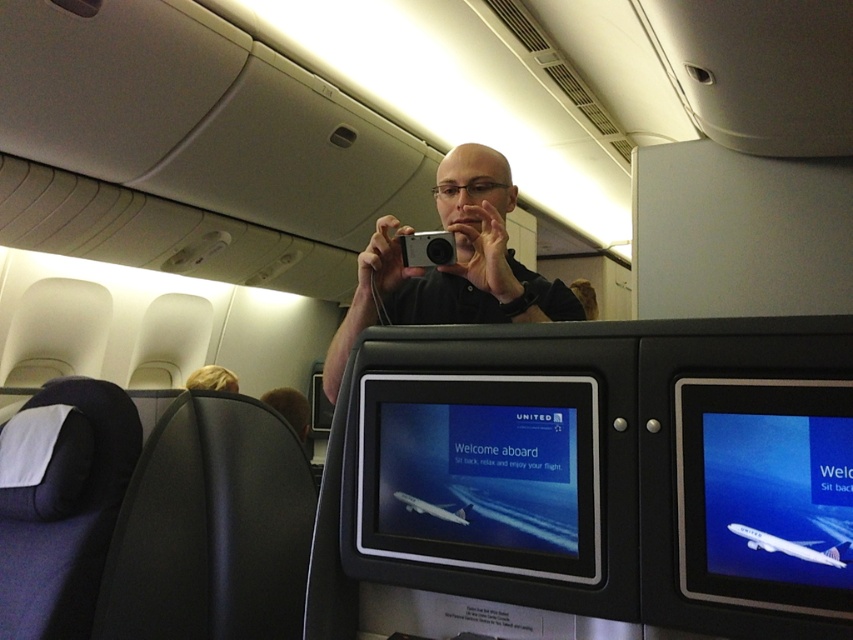
Can you confirm if blue glossy airplane at center is thinner than white glossy airplane at upper center?

Incorrect, blue glossy airplane at center's width is not less than white glossy airplane at upper center's.

Is point (770, 464) positioned after point (776, 536)?

That is True.

Where is `blue glossy airplane at center`? The width and height of the screenshot is (853, 640). blue glossy airplane at center is located at coordinates (778, 497).

Which is below, black matte camera at center or silver metallic camera at center?

black matte camera at center

Who is more forward, (448, 163) or (428, 248)?

Point (428, 248) is in front.

This screenshot has width=853, height=640. I want to click on black matte camera at center, so click(x=450, y=264).

Who is more forward, (755,540) or (410,506)?

Point (755,540) is more forward.

Is point (776, 540) closer to viewer compared to point (463, 512)?

Yes, it is in front of point (463, 512).

Identify the location of white glossy airplane at upper center. Image resolution: width=853 pixels, height=640 pixels. (785, 545).